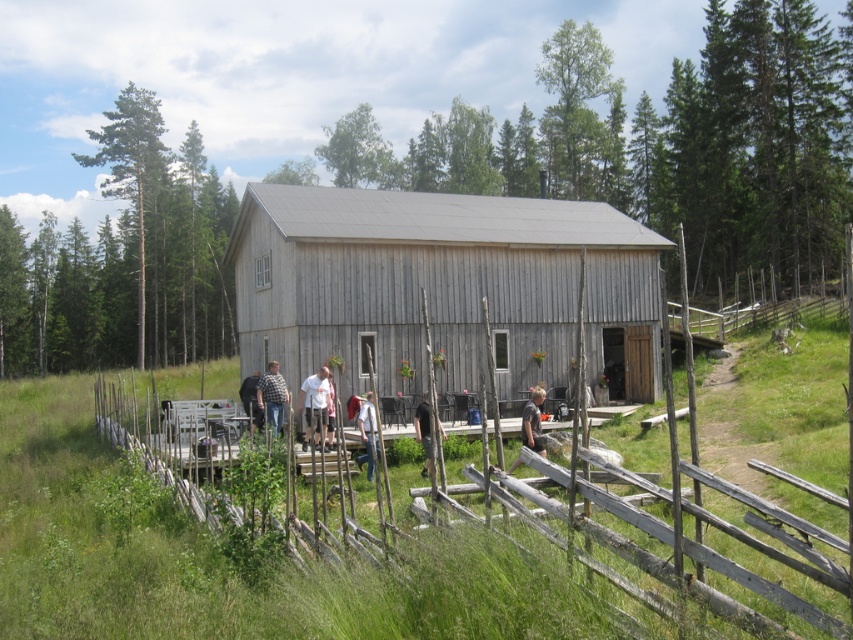
Question: Is weathered wood fence at center smaller than light brown wooden chair at center?

Choices:
 (A) yes
 (B) no

Answer: (B)

Question: Does wooden barn at center appear over white cotton shirt at center?

Choices:
 (A) no
 (B) yes

Answer: (B)

Question: Among these objects, which one is farthest from the camera?

Choices:
 (A) light blue denim jeans at center
 (B) light brown wooden bench at center
 (C) white cotton shirt at center

Answer: (C)

Question: Does wooden barn at center appear under light brown wooden bench at center?

Choices:
 (A) no
 (B) yes

Answer: (A)

Question: Which point is farther to the camera?

Choices:
 (A) weathered wood fence at center
 (B) light blue denim jeans at center
 (C) light brown wooden bench at center

Answer: (C)

Question: Based on their relative distances, which object is nearer to the dark gray shirt at center?

Choices:
 (A) light brown wooden bench at center
 (B) weathered wood fence at center
 (C) light blue denim jeans at center

Answer: (C)